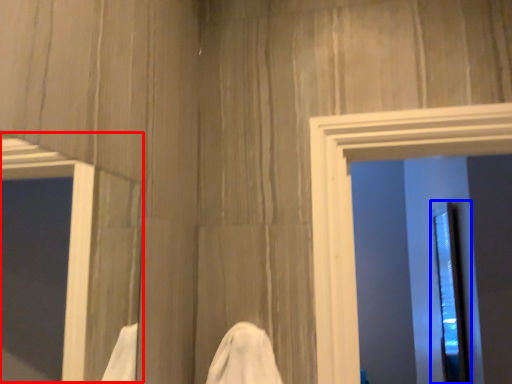
Question: Among these objects, which one is nearest to the camera, window (highlighted by a red box) or screen door (highlighted by a blue box)?

Choices:
 (A) window
 (B) screen door

Answer: (A)